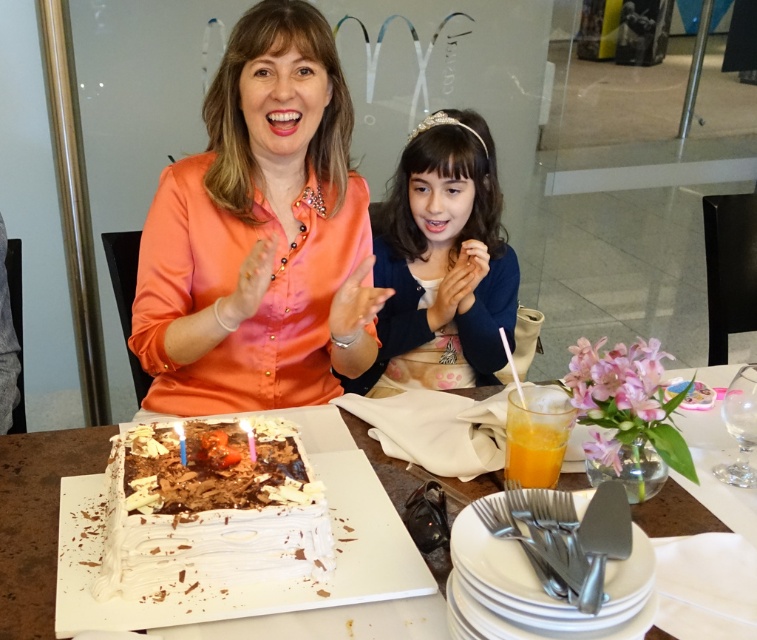
Can you confirm if orange satin blouse at upper left is shorter than translucent glass cup at lower right?

Incorrect, orange satin blouse at upper left's height does not fall short of translucent glass cup at lower right's.

Who is more forward, (248, 168) or (522, 440)?

Positioned in front is point (522, 440).

Is point (145, 314) positioned before point (547, 445)?

That is False.

I want to click on orange satin blouse at upper left, so click(x=260, y=234).

Who is positioned more to the right, white chocolate cake at center or translucent glass cup at lower right?

translucent glass cup at lower right

Looking at this image, which is more to the left, white chocolate cake at center or translucent glass cup at lower right?

From the viewer's perspective, white chocolate cake at center appears more on the left side.

Is point (217, 486) closer to camera compared to point (509, 442)?

Yes, it is.

The image size is (757, 640). Identify the location of white chocolate cake at center. pyautogui.click(x=210, y=508).

Can you confirm if white chocolate cake at center is positioned to the left of matte blue sweater at center?

Indeed, white chocolate cake at center is positioned on the left side of matte blue sweater at center.

Does point (217, 467) come behind point (413, 253)?

No, (217, 467) is in front of (413, 253).

At what (x,y) coordinates should I click in order to perform the action: click on white chocolate cake at center. Please return your answer as a coordinate pair (x, y). The width and height of the screenshot is (757, 640). Looking at the image, I should click on (210, 508).